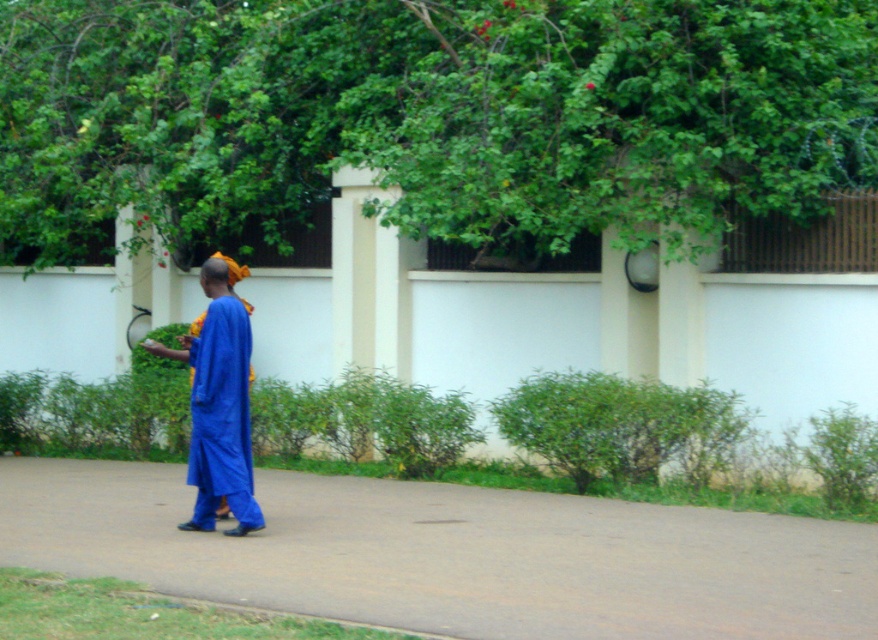
Is green leafy tree at upper center above blue cotton robe at center?

Yes.

Does point (448, 163) come farther from viewer compared to point (193, 445)?

That is True.

Locate an element on the screen. green leafy tree at upper center is located at coordinates (428, 116).

Between smooth concrete pavement at center and blue cotton robe at center, which one has less height?

smooth concrete pavement at center

Describe the element at coordinates (450, 554) in the screenshot. I see `smooth concrete pavement at center` at that location.

Find the location of `smooth concrete pavement at center`. smooth concrete pavement at center is located at coordinates (450, 554).

Does point (84, 124) come in front of point (857, 608)?

No, it is behind (857, 608).

How much distance is there between green leafy tree at upper center and smooth concrete pavement at center?

A distance of 6.37 meters exists between green leafy tree at upper center and smooth concrete pavement at center.

Which is in front, point (416, 29) or point (799, 579)?

Point (799, 579) is more forward.

Where is `green leafy tree at upper center`? green leafy tree at upper center is located at coordinates (428, 116).